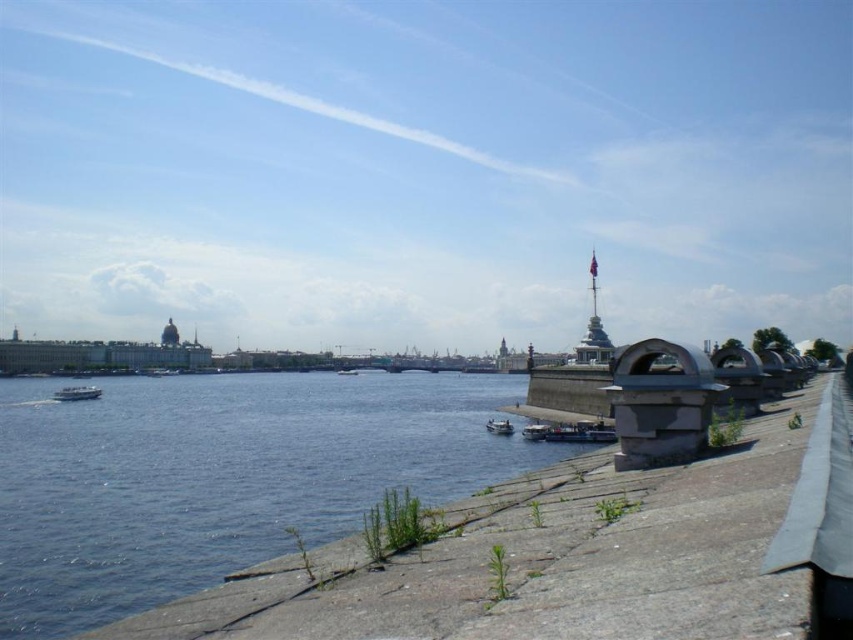
Is metallic silver boat at center wider than white glossy boat at center?

No.

Does metallic silver boat at center appear on the left side of white glossy boat at center?

In fact, metallic silver boat at center is to the right of white glossy boat at center.

Measure the distance between metallic silver boat at center and camera.

metallic silver boat at center and camera are 138.66 meters apart.

Locate an element on the screen. metallic silver boat at center is located at coordinates (498, 426).

The height and width of the screenshot is (640, 853). Find the location of `blue water at lower left`. blue water at lower left is located at coordinates 221,477.

Can you confirm if blue water at lower left is positioned to the left of white glossy boat at center?

Indeed, blue water at lower left is positioned on the left side of white glossy boat at center.

This screenshot has height=640, width=853. I want to click on blue water at lower left, so click(221, 477).

The width and height of the screenshot is (853, 640). I want to click on blue water at lower left, so click(x=221, y=477).

Is metallic blue boat at lower center wider than white glossy boat at center?

No, metallic blue boat at lower center is not wider than white glossy boat at center.

Locate an element on the screen. The height and width of the screenshot is (640, 853). metallic blue boat at lower center is located at coordinates (535, 432).